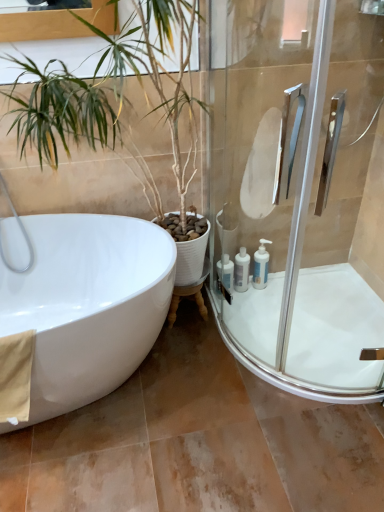
Locate an element on the screen. The image size is (384, 512). unoccupied region to the right of white plastic bottles at right, positioned as the third toiletry in left-to-right order is located at coordinates (281, 294).